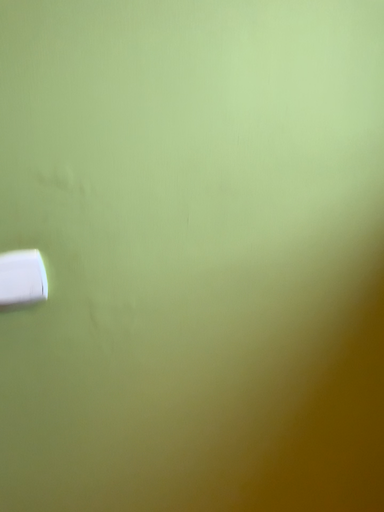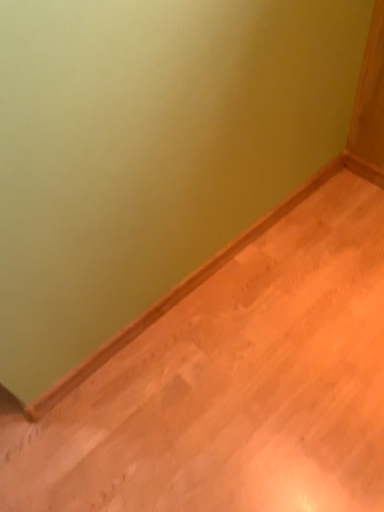
Question: How did the camera likely rotate when shooting the video?

Choices:
 (A) rotated downward
 (B) rotated upward

Answer: (A)